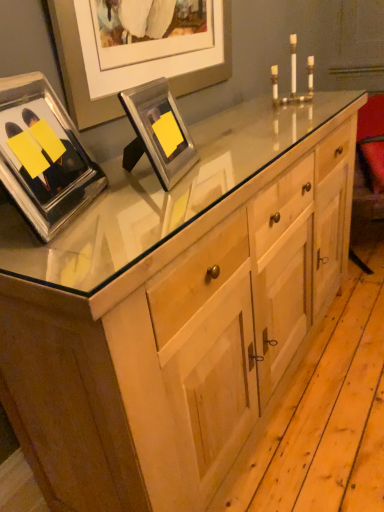
Question: Is point (309, 91) closer or farther from the camera than point (26, 129)?

Choices:
 (A) farther
 (B) closer

Answer: (A)

Question: In terms of height, does gold metallic candle holder at upper center look taller or shorter compared to clear glass picture frame at upper left, which is the second picture frame in right-to-left order?

Choices:
 (A) short
 (B) tall

Answer: (A)

Question: Which object is positioned farthest from the gold metallic candle holder at upper center?

Choices:
 (A) metallic silver picture frame at upper center, arranged as the second picture frame when viewed from the left
 (B) clear glass picture frame at upper left, which is the 1th picture frame from left to right

Answer: (B)

Question: Which object is the closest to the gold metallic candle holder at upper center?

Choices:
 (A) clear glass picture frame at upper left, which is the 1th picture frame from left to right
 (B) metallic silver picture frame at upper center, arranged as the second picture frame when viewed from the left

Answer: (B)